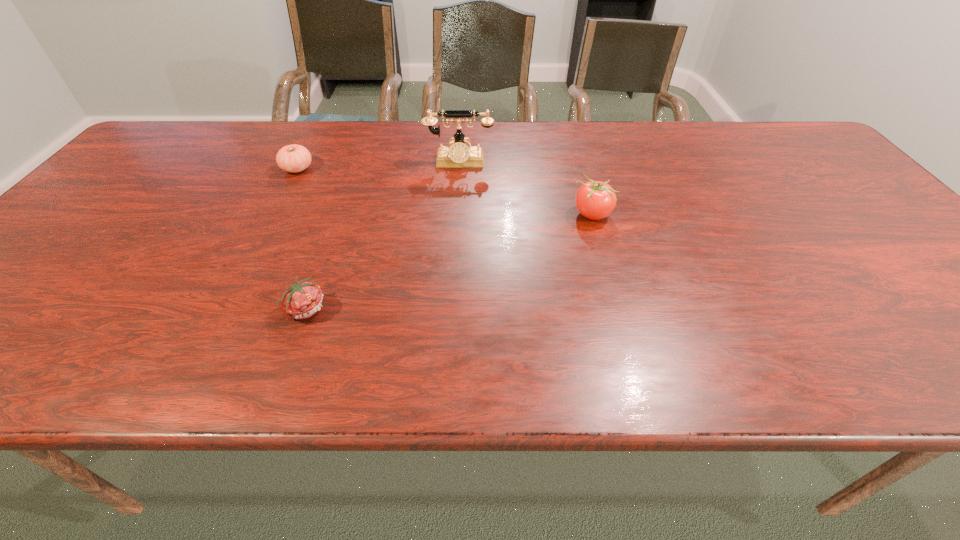
Find the location of a particular element. The image size is (960, 540). empty space that is in between the rightmost tomato and the leftmost object is located at coordinates (444, 192).

Locate an element on the screen. blank region between the leftmost tomato and the rightmost object is located at coordinates (444, 192).

This screenshot has height=540, width=960. I want to click on vacant point located between the leftmost object and the telephone, so click(378, 166).

This screenshot has width=960, height=540. Find the location of `vacant area that lies between the second farthest tomato and the second tomato from left to right`. vacant area that lies between the second farthest tomato and the second tomato from left to right is located at coordinates (449, 261).

Find the location of `vacant region between the third object from right to left and the rightmost tomato`. vacant region between the third object from right to left and the rightmost tomato is located at coordinates (449, 261).

The height and width of the screenshot is (540, 960). I want to click on free space that is in between the third object from right to left and the third farthest object, so (449, 261).

Identify the location of vacant area between the leftmost object and the tallest object. This screenshot has width=960, height=540. (378, 166).

Locate an element on the screen. Image resolution: width=960 pixels, height=540 pixels. blank region between the nearest object and the second nearest object is located at coordinates (449, 261).

I want to click on object that is the closest one to the rightmost tomato, so click(458, 155).

Identify which object is the third nearest to the second tallest object. Please provide its 2D coordinates. Your answer should be formatted as a tuple, i.e. [(x, y)], where the tuple contains the x and y coordinates of a point satisfying the conditions above.

[(294, 158)]